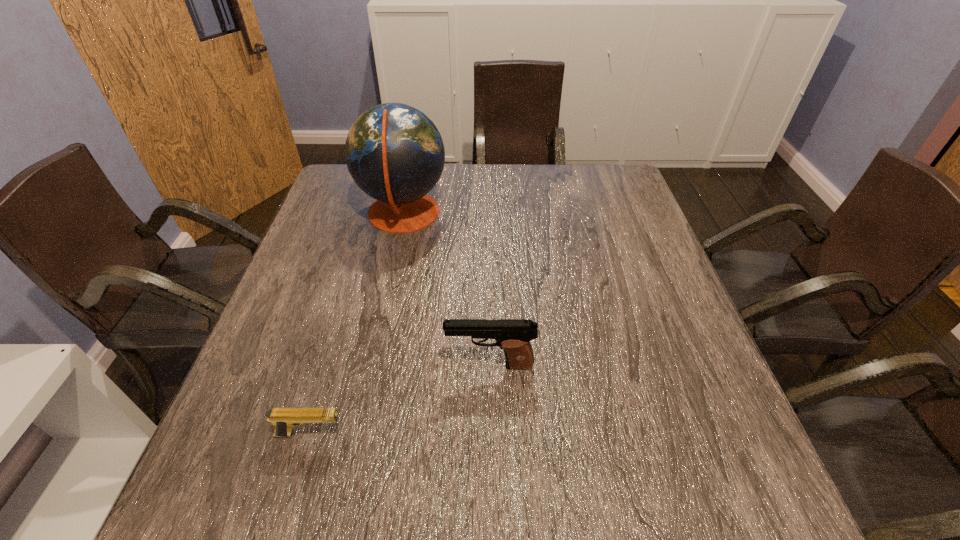
Find the location of a particular element. This screenshot has width=960, height=540. vacant space located at the barrel of the shortest object is located at coordinates (419, 434).

In order to click on object that is at the far edge in this screenshot , I will do `click(395, 154)`.

Where is `globe located in the left edge section of the desktop`? This screenshot has height=540, width=960. globe located in the left edge section of the desktop is located at coordinates (395, 154).

Where is `pistol at the left edge`? The image size is (960, 540). pistol at the left edge is located at coordinates (284, 419).

Find the location of a particular element. The width and height of the screenshot is (960, 540). object that is at the far left corner is located at coordinates (395, 154).

In the image, there is a desktop. Where is `vacant space at the far edge`? vacant space at the far edge is located at coordinates [528, 176].

Find the location of a particular element. The width and height of the screenshot is (960, 540). free space at the left edge is located at coordinates (303, 383).

In the image, there is a desktop. Where is `vacant space at the right edge`? vacant space at the right edge is located at coordinates (636, 331).

Find the location of a particular element. vacant region at the far left corner of the desktop is located at coordinates (361, 193).

The height and width of the screenshot is (540, 960). In the image, there is a desktop. In order to click on free space at the far right corner in this screenshot , I will do `click(625, 186)`.